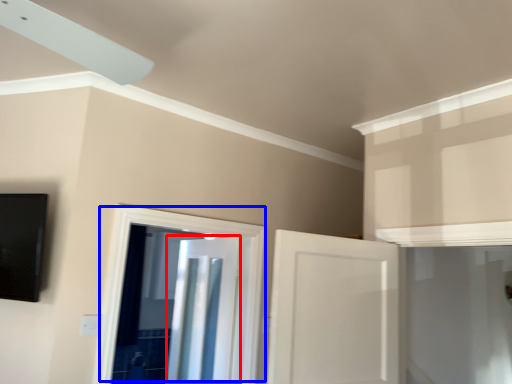
Question: Which point is closer to the camera, door (highlighted by a red box) or door (highlighted by a blue box)?

Choices:
 (A) door
 (B) door

Answer: (B)